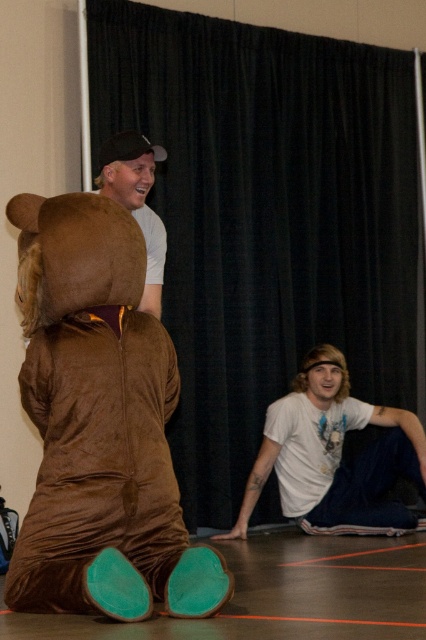
Which is in front, point (155, 220) or point (129, 164)?

Point (129, 164) is in front.

Who is taller, matte brown bear at center or matte brown bear at upper left?

matte brown bear at center

Is point (123, 188) closer to viewer compared to point (154, 177)?

Yes, point (123, 188) is in front of point (154, 177).

What are the coordinates of `matte brown bear at center` in the screenshot? It's located at (137, 202).

In the scene shown: Does black velvet curtain at upper center appear over brown velvety bear at center?

Yes.

This screenshot has height=640, width=426. What do you see at coordinates (265, 218) in the screenshot? I see `black velvet curtain at upper center` at bounding box center [265, 218].

This screenshot has height=640, width=426. In order to click on black velvet curtain at upper center in this screenshot , I will do `click(265, 218)`.

Does brown velvety bear at center have a larger size compared to matte brown bear at upper left?

Yes.

Is point (112, 381) less distant than point (134, 148)?

Yes, point (112, 381) is closer to viewer.

Which is in front, point (23, 308) or point (141, 173)?

Point (23, 308) is more forward.

Locate an element on the screen. This screenshot has width=426, height=640. brown velvety bear at center is located at coordinates (100, 424).